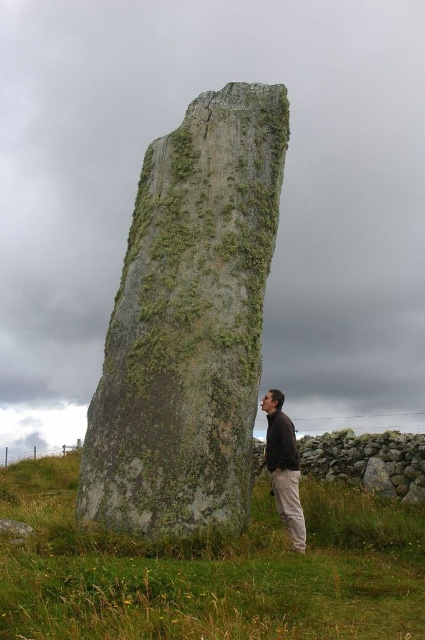
Question: Which point is farther from the camera taking this photo?

Choices:
 (A) (294, 465)
 (B) (96, 460)
 (C) (255, 634)

Answer: (A)

Question: Which point appears closest to the camera in this image?

Choices:
 (A) [x=354, y=502]
 (B) [x=229, y=115]
 (C) [x=283, y=474]

Answer: (C)

Question: Which point appears closest to the camera in this image?

Choices:
 (A) (379, 593)
 (B) (291, 461)

Answer: (A)

Question: In this image, where is green grassy at lower center located relative to dark brown leather jacket at lower right?

Choices:
 (A) below
 (B) above

Answer: (A)

Question: Does green grassy at lower center have a smaller size compared to dark brown leather jacket at lower right?

Choices:
 (A) no
 (B) yes

Answer: (A)

Question: Does green mossy stone at center have a smaller size compared to green grassy at lower center?

Choices:
 (A) no
 (B) yes

Answer: (B)